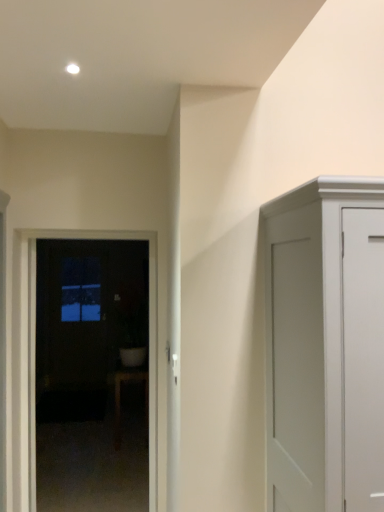
Identify the location of matte black door at center. (149, 343).

What do you see at coordinates (149, 343) in the screenshot? Image resolution: width=384 pixels, height=512 pixels. I see `matte black door at center` at bounding box center [149, 343].

Measure the distance between point (29, 466) and camera.

Point (29, 466) and camera are 2.84 meters apart from each other.

Locate an element on the screen. matte black door at center is located at coordinates (149, 343).